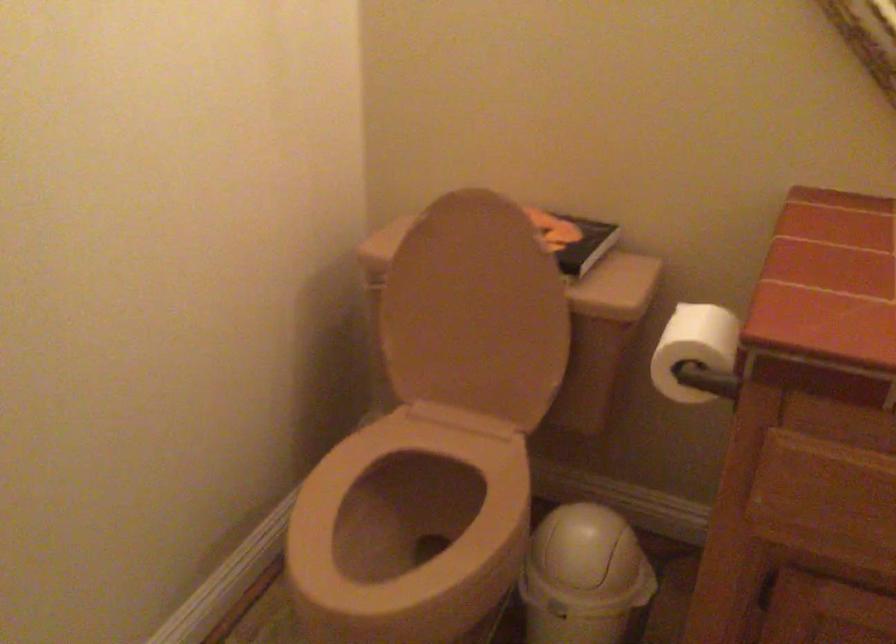
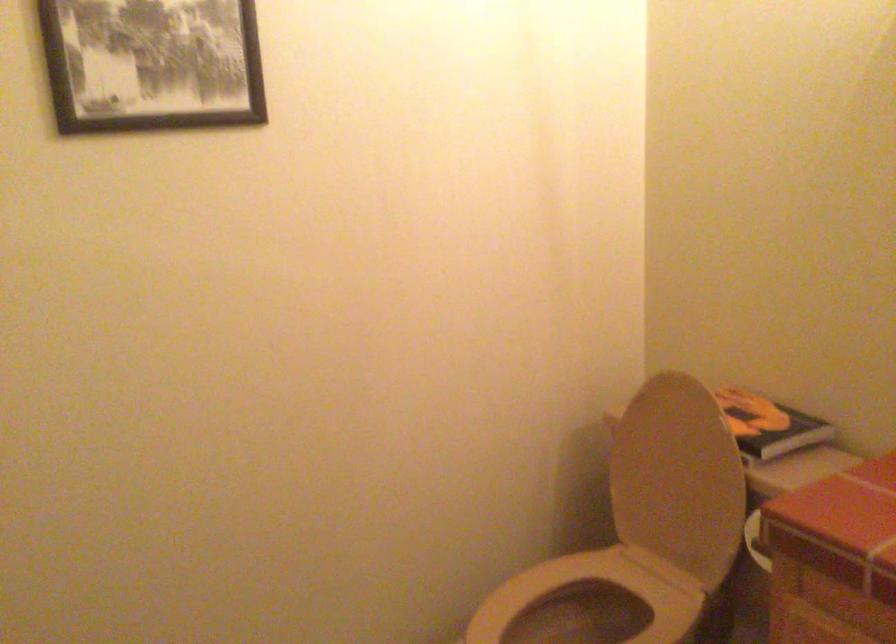
In the second image, find the point that corresponds to (x=388, y=468) in the first image.

(599, 592)